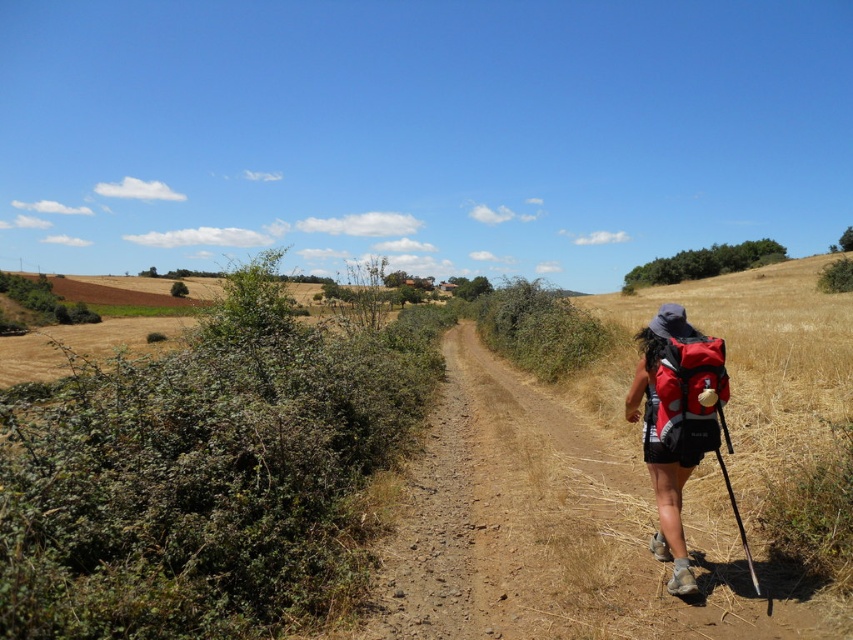
Question: Is red fabric backpack at right above red matte backpack at right?

Choices:
 (A) no
 (B) yes

Answer: (A)

Question: Is red fabric backpack at right thinner than red matte backpack at right?

Choices:
 (A) yes
 (B) no

Answer: (A)

Question: Is red fabric backpack at right wider than red matte backpack at right?

Choices:
 (A) yes
 (B) no

Answer: (B)

Question: Which object appears closest to the camera in this image?

Choices:
 (A) red matte backpack at right
 (B) red fabric backpack at right

Answer: (B)